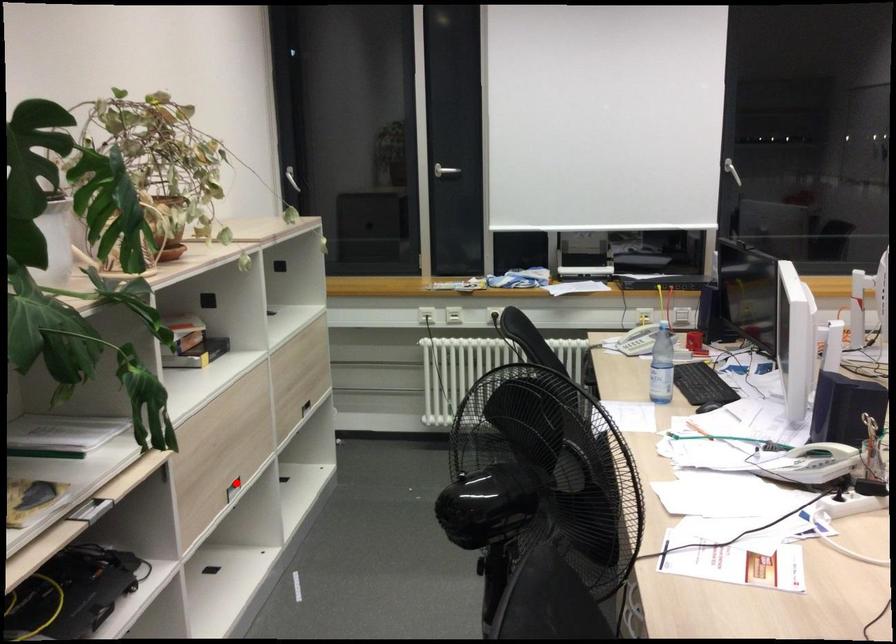
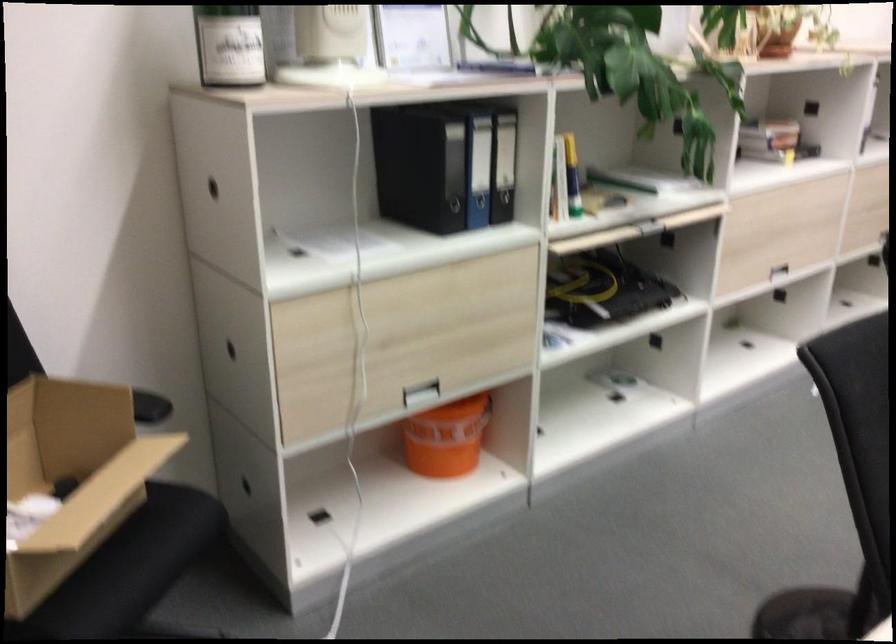
Where in the second image is the point corresponding to the highlighted location from the first image?

(771, 266)